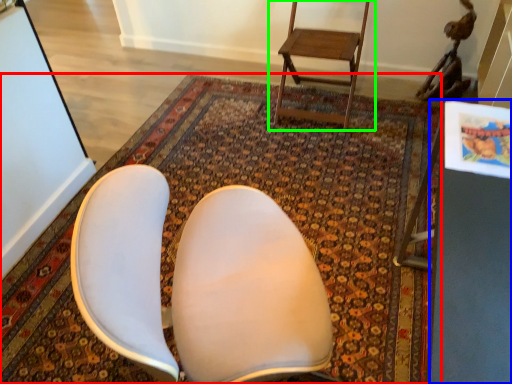
Question: Considering the real-world distances, which object is farthest from mat (highlighted by a red box)? table (highlighted by a blue box) or chair (highlighted by a green box)?

Choices:
 (A) table
 (B) chair

Answer: (A)